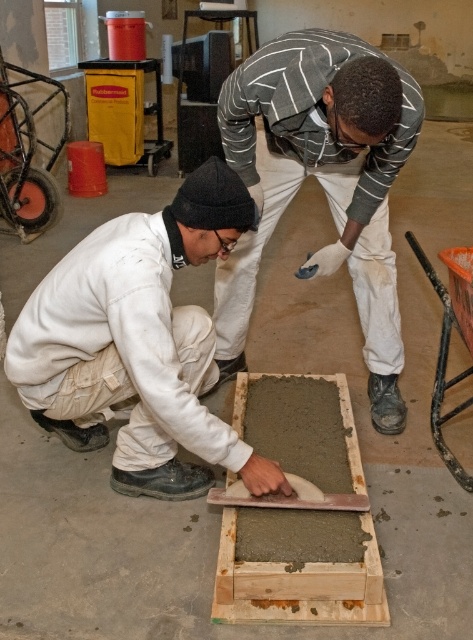
Question: Which point appears farthest from the camera in this image?

Choices:
 (A) (295, 42)
 (B) (69, 310)
 (C) (224, 566)

Answer: (A)

Question: Does striped sweater at center appear under smooth concrete plank at center?

Choices:
 (A) yes
 (B) no

Answer: (B)

Question: Can you confirm if white matte uniform at lower left is thinner than smooth concrete plank at center?

Choices:
 (A) no
 (B) yes

Answer: (A)

Question: Which object is the closest to the striped sweater at center?

Choices:
 (A) smooth concrete plank at center
 (B) white matte uniform at lower left

Answer: (B)

Question: Estimate the real-world distances between objects in this image. Which object is farther from the smooth concrete plank at center?

Choices:
 (A) white matte uniform at lower left
 (B) striped sweater at center

Answer: (B)

Question: Can you confirm if white matte uniform at lower left is positioned to the right of smooth concrete plank at center?

Choices:
 (A) no
 (B) yes

Answer: (A)